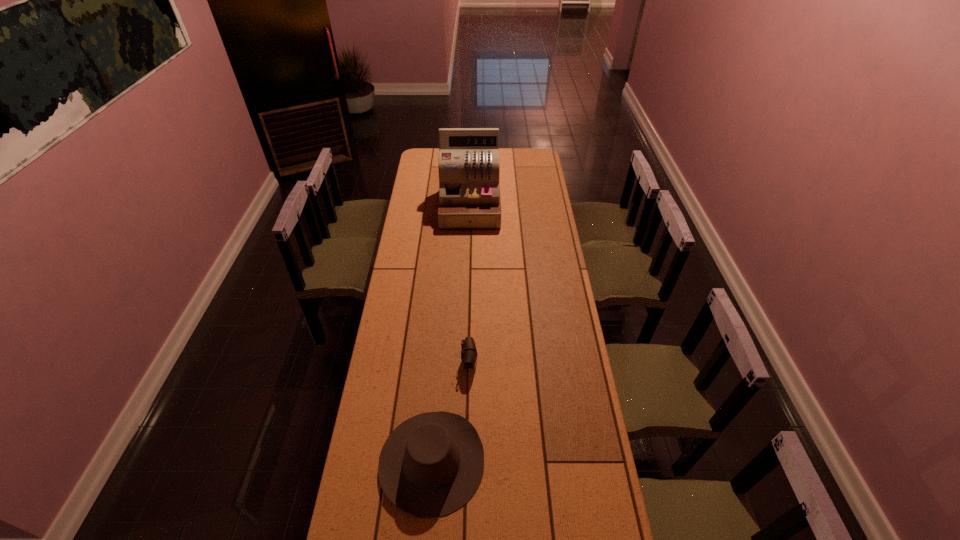
In the image, there is a desktop. Where is `blank space at the left edge`? The height and width of the screenshot is (540, 960). blank space at the left edge is located at coordinates (430, 197).

This screenshot has height=540, width=960. In the image, there is a desktop. Identify the location of vacant space at the right edge. (550, 192).

This screenshot has width=960, height=540. In order to click on blank area at the far left corner in this screenshot , I will do `click(434, 153)`.

Identify the location of vacant area that lies between the nearest object and the farthest object. This screenshot has height=540, width=960. (451, 334).

Where is `free space between the nearest object and the pouch`? The width and height of the screenshot is (960, 540). free space between the nearest object and the pouch is located at coordinates (450, 411).

Find the location of `vacant area that lies between the shortest object and the cash register`. vacant area that lies between the shortest object and the cash register is located at coordinates (469, 285).

The height and width of the screenshot is (540, 960). What are the coordinates of `vacant area between the second shortest object and the farthest object` in the screenshot? It's located at (451, 334).

This screenshot has height=540, width=960. I want to click on vacant space that is in between the tallest object and the cowboy hat, so click(x=451, y=334).

Identify the location of free space between the pouch and the nearest object. Image resolution: width=960 pixels, height=540 pixels. (450, 411).

Identify which object is the second nearest to the second farthest object. Please provide its 2D coordinates. Your answer should be formatted as a tuple, i.e. [(x, y)], where the tuple contains the x and y coordinates of a point satisfying the conditions above.

[(469, 193)]